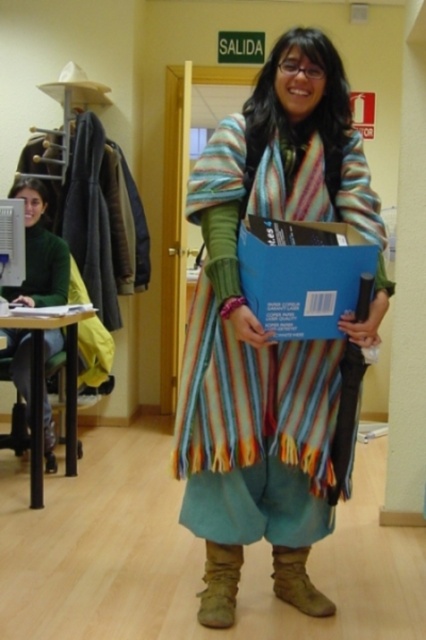
Does striped woolen poncho at center have a greater width compared to green matte sweater at left?

Yes, striped woolen poncho at center is wider than green matte sweater at left.

Is point (258, 144) more distant than point (25, 362)?

No, it is in front of (25, 362).

Who is more distant from viewer, (209,576) or (16,342)?

Point (16,342)

Identify the location of striped woolen poncho at center. (264, 330).